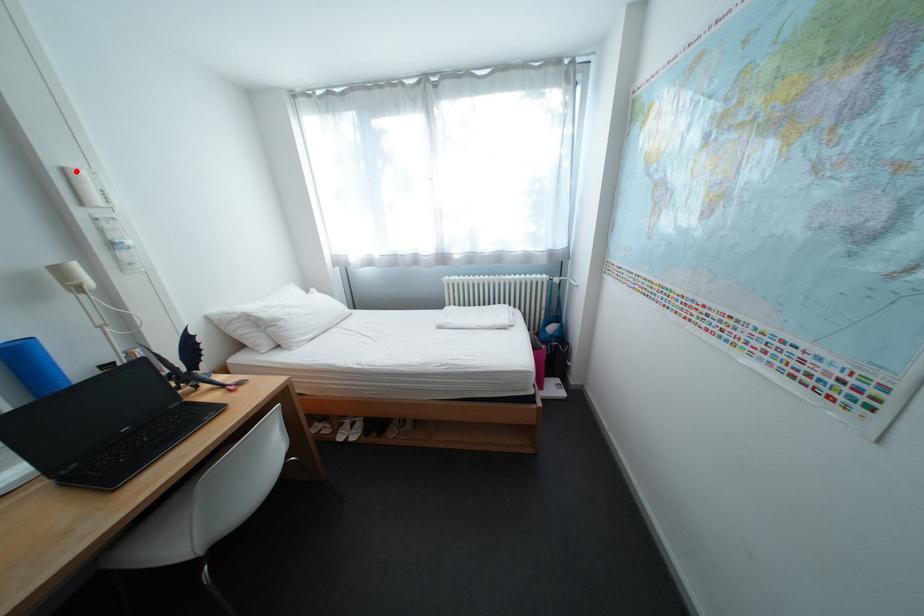
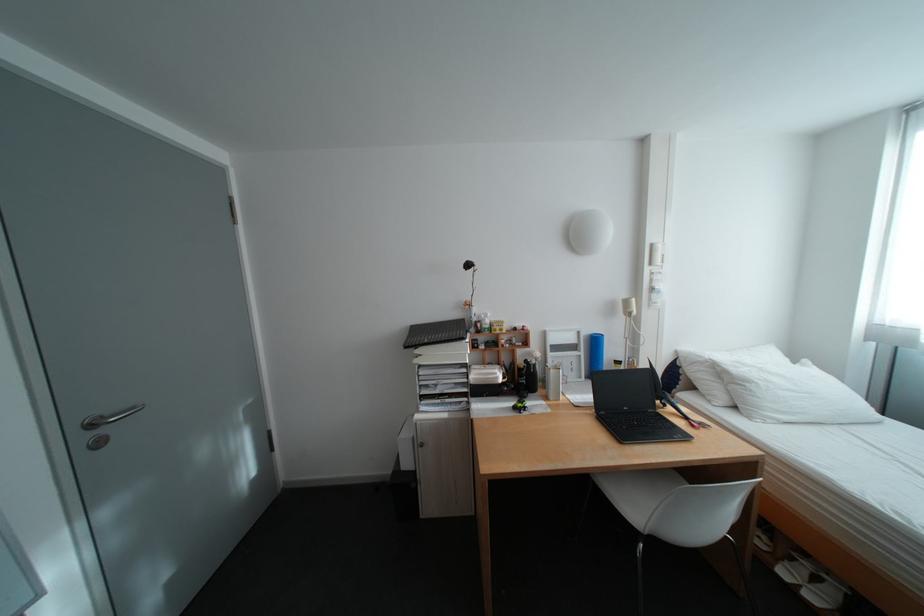
Where in the second image is the point corresponding to the highlighted location from the first image?

(664, 246)